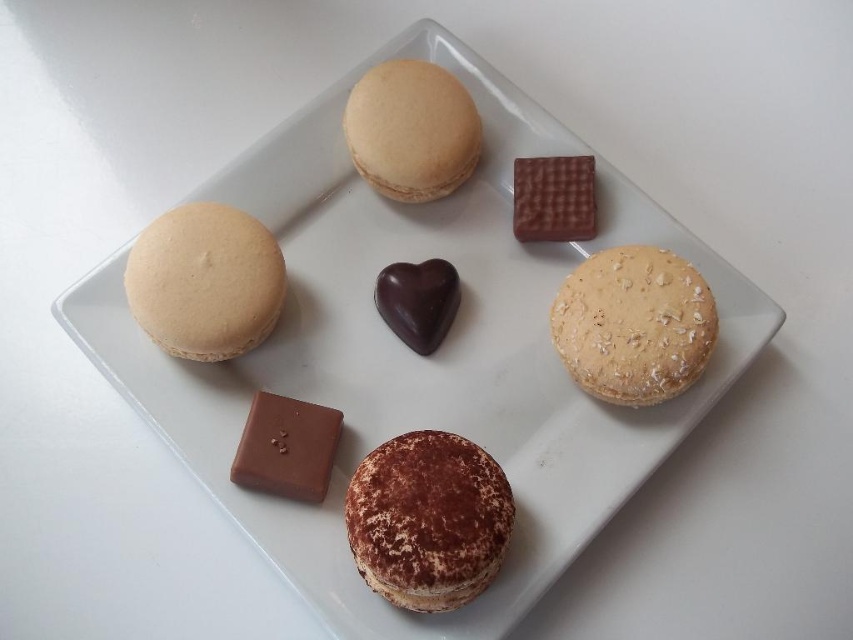
Question: Which object is positioned closest to the brown textured macaron at center?

Choices:
 (A) matte beige macaron at upper left
 (B) oatmeal cookie at lower right
 (C) dark chocolate heart at center
 (D) smooth dark chocolate at upper center

Answer: (C)

Question: Can you confirm if oatmeal cookie at lower right is thinner than smooth brown chocolate bar at bottom left?

Choices:
 (A) no
 (B) yes

Answer: (A)

Question: Estimate the real-world distances between objects in this image. Which object is farther from the smooth brown chocolate bar at bottom left?

Choices:
 (A) dark chocolate heart at center
 (B) smooth dark chocolate at upper center

Answer: (B)

Question: Estimate the real-world distances between objects in this image. Which object is closer to the matte beige macaron at upper center?

Choices:
 (A) matte beige macaron at upper left
 (B) oatmeal cookie at lower right
 (C) dark chocolate heart at center

Answer: (C)

Question: Does brown textured macaron at center appear over smooth brown chocolate bar at bottom left?

Choices:
 (A) no
 (B) yes

Answer: (A)

Question: Is smooth dark chocolate at upper center bigger than dark chocolate heart at center?

Choices:
 (A) no
 (B) yes

Answer: (A)